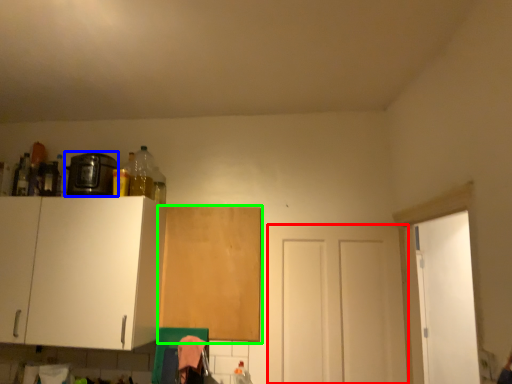
Question: Which is farther away from door (highlighted by a red box)? appliance (highlighted by a blue box) or cabinetry (highlighted by a green box)?

Choices:
 (A) appliance
 (B) cabinetry

Answer: (A)